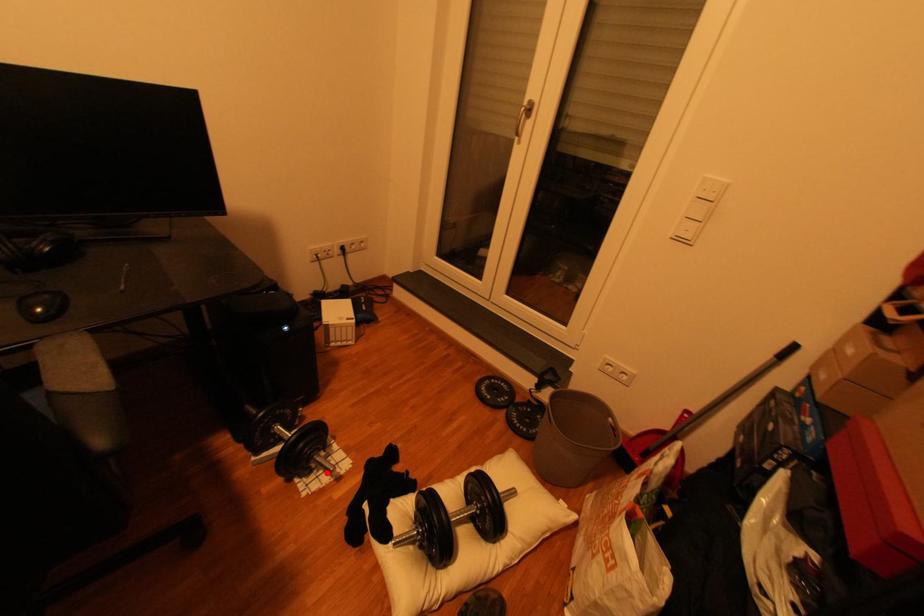
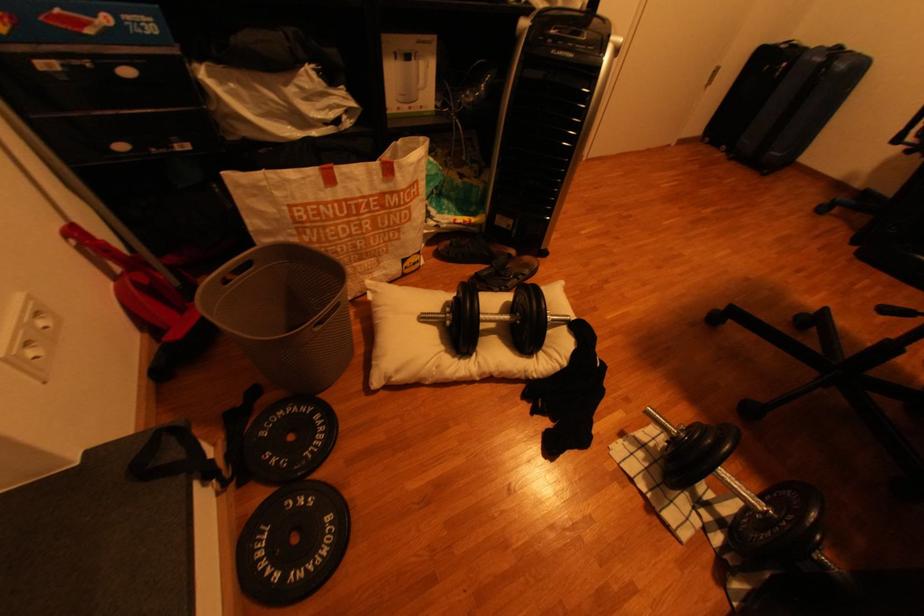
Locate, in the second image, the point that corresponds to the highlighted location in the first image.

(665, 446)